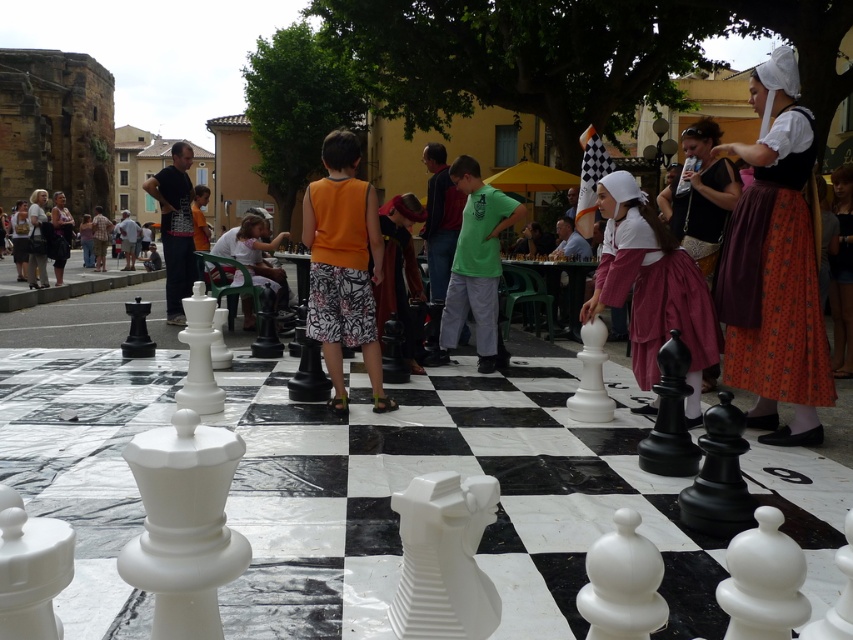
You are a photographer trying to capture a clear shot of the green matte shirt at center and the white plastic chair at center. Which object will appear larger in your photo?

The green matte shirt at center will appear larger in the photo because it is much taller than the white plastic chair at center.

You are standing at the chessboard and see the point marked at coordinate (474, 266). What object is located at that point?

The point at coordinate (474, 266) marks the green matte shirt at center.

You are a photographer trying to capture a clear shot of the orange printed skirt at center and the orange fabric shorts at center. If you want to ensure both are fully visible in the frame, which object should you focus on to avoid cropping?

You should focus on the orange printed skirt at center because it might be wider than the orange fabric shorts at center, so ensuring the wider object is centered will help both fit in the frame.